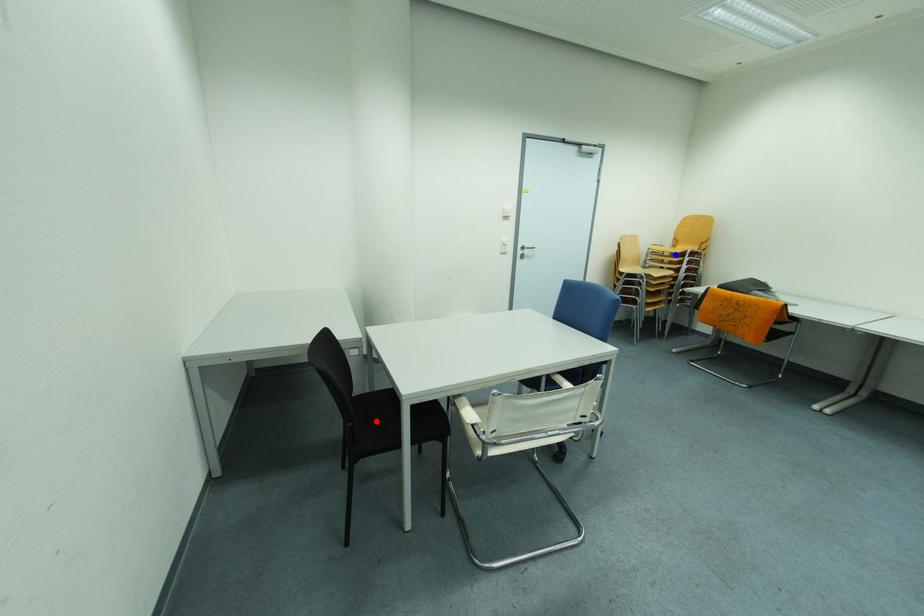
Question: Which of the two points in the image is closer to the camera?

Choices:
 (A) Blue point is closer.
 (B) Red point is closer.

Answer: (B)